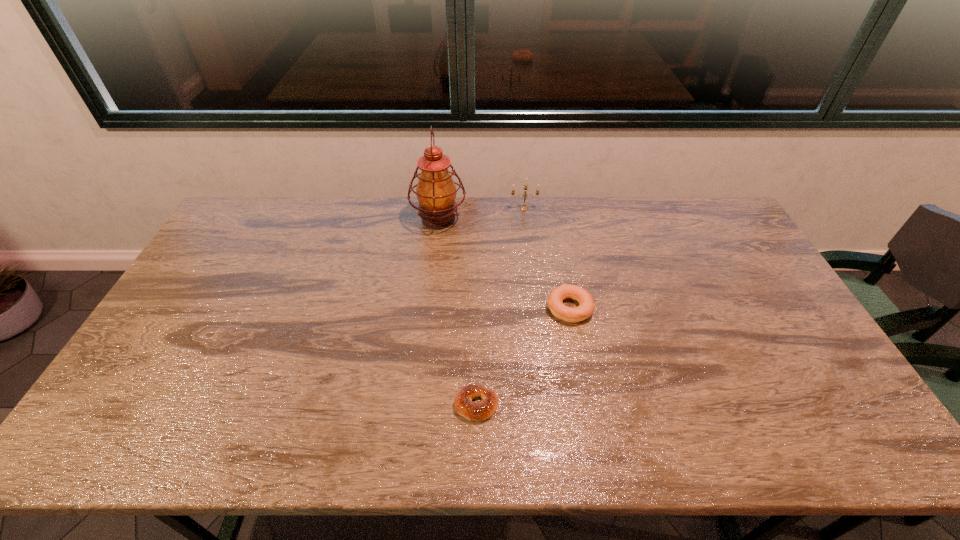
Identify the location of oil lamp located at the far edge. This screenshot has height=540, width=960. (436, 192).

Locate an element on the screen. The height and width of the screenshot is (540, 960). candle that is at the far edge is located at coordinates (523, 208).

The height and width of the screenshot is (540, 960). I want to click on object located at the near edge, so click(463, 404).

The height and width of the screenshot is (540, 960). Identify the location of vacant space at the far edge. (658, 232).

The height and width of the screenshot is (540, 960). In order to click on free space at the near edge of the desktop in this screenshot , I will do `click(446, 423)`.

In the image, there is a desktop. Where is `vacant space at the left edge`? The width and height of the screenshot is (960, 540). vacant space at the left edge is located at coordinates (169, 399).

This screenshot has height=540, width=960. I want to click on vacant space at the right edge of the desktop, so click(776, 323).

Image resolution: width=960 pixels, height=540 pixels. In the image, there is a desktop. Identify the location of vacant space at the near right corner. (858, 426).

I want to click on vacant area that lies between the right bagel and the candle, so click(x=546, y=258).

Where is `empty space that is in between the nearest object and the third shortest object`? This screenshot has height=540, width=960. empty space that is in between the nearest object and the third shortest object is located at coordinates (500, 307).